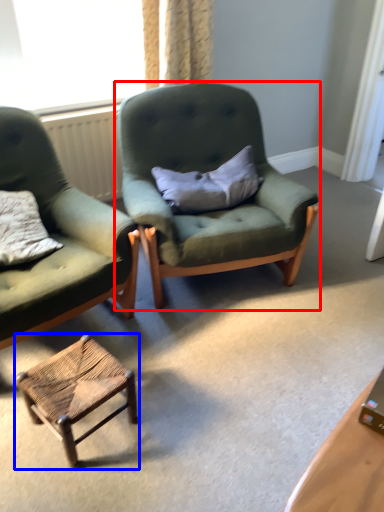
Question: Which point is further to the camera, chair (highlighted by a red box) or stool (highlighted by a blue box)?

Choices:
 (A) chair
 (B) stool

Answer: (A)